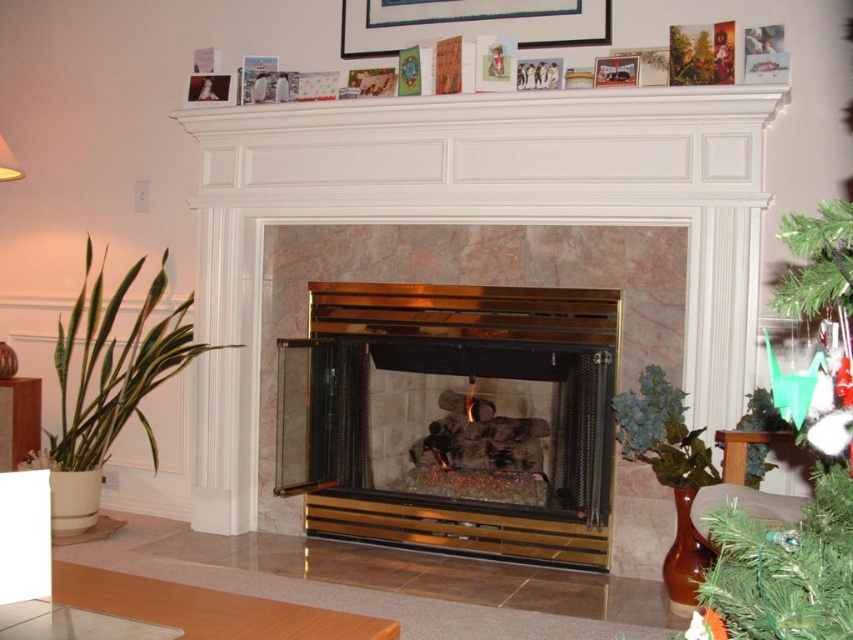
From the picture: You are standing in the living room and want to move from the point at coordinates point (485, 10) to the point at coordinates point (602, 80). Can you walk directly between them without any obstacles?

Point (485, 10) is behind point (602, 80), so you cannot walk directly between them without going around the obstacle in front.

You are an interior designer assessing the placement of frames above the fireplace. The metallic silver picture frame at upper center and the metallic photo frame at upper center are both mounted on the mantel. Which frame takes up more horizontal space?

The metallic photo frame at upper center has a greater width than the metallic silver picture frame at upper center, so it occupies more horizontal space.